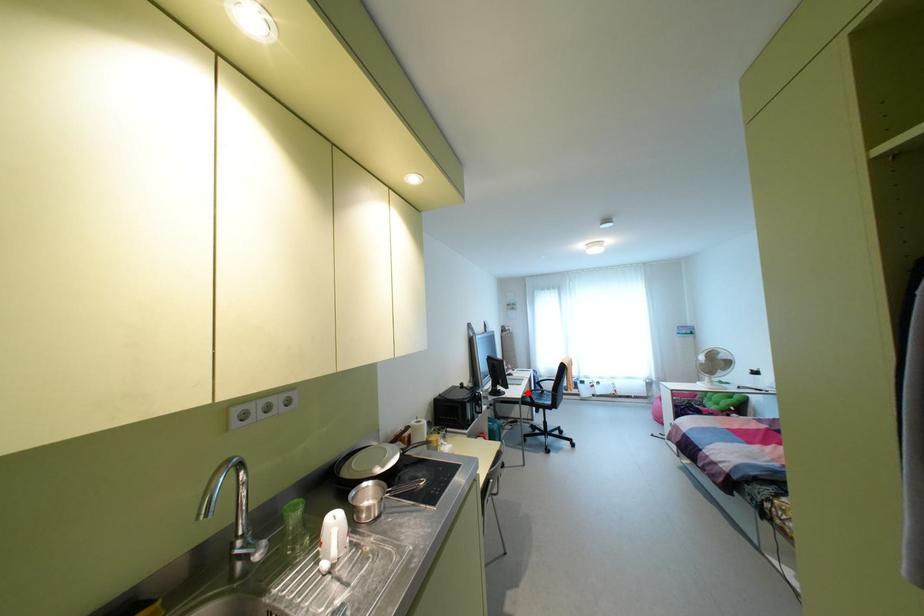
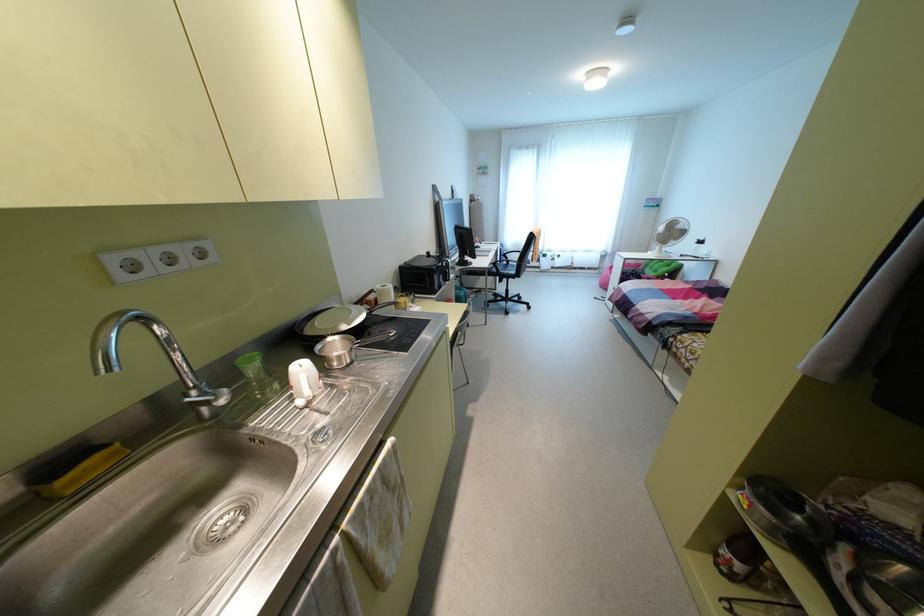
Question: I am providing you with two images of the same scene from different viewpoints. A red point is shown in image1. For the corresponding object point in image2, is it positioned nearer or farther from the camera?

Choices:
 (A) Nearer
 (B) Farther

Answer: (A)